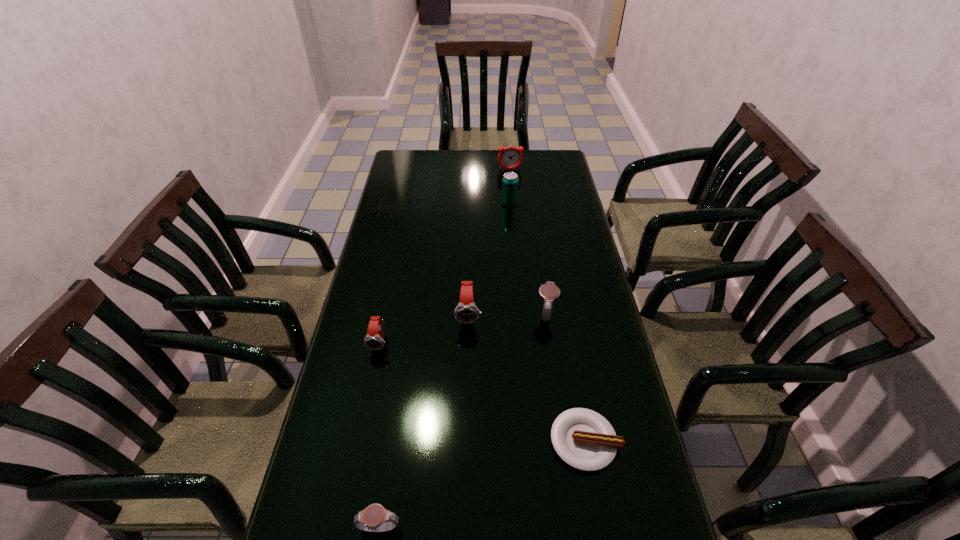
I want to click on the second farthest object, so click(510, 182).

Where is `beer can`? beer can is located at coordinates (510, 182).

Find the location of `the farther red watch`. the farther red watch is located at coordinates (466, 312).

The height and width of the screenshot is (540, 960). What are the coordinates of `the right red watch` in the screenshot? It's located at (466, 312).

Identify the location of the farthest object. This screenshot has height=540, width=960. (510, 157).

This screenshot has width=960, height=540. In order to click on alarm clock in this screenshot , I will do `click(510, 157)`.

The width and height of the screenshot is (960, 540). What are the coordinates of `the bigger gray watch` in the screenshot? It's located at (549, 291).

The image size is (960, 540). In order to click on the farther gray watch in this screenshot , I will do `click(549, 291)`.

Where is `the third farthest watch`? The height and width of the screenshot is (540, 960). the third farthest watch is located at coordinates point(374,340).

This screenshot has width=960, height=540. What are the coordinates of `the nearer red watch` in the screenshot? It's located at tap(374, 340).